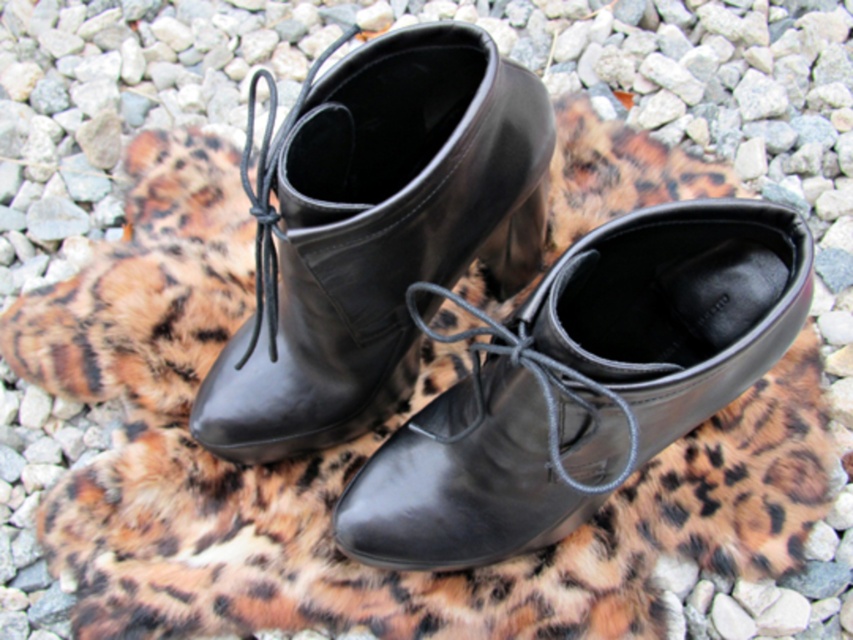
You are a delivery person who needs to place a package between the black leather shoe at center and the shiny black boot at center. The package is 7 inches long. Can you fit it between them without moving the shoes?

The black leather shoe at center and shiny black boot at center are 8.18 inches apart from each other. Since the package is 7 inches long, it can fit between them as the distance between the two shoes is greater than the package length.

You are organizing a shoe display and need to place the black leather shoe at center and the shiny black boot at center on a shelf. The shelf has limited vertical space. Based on their positions in the image, which one should you place first to ensure both fit vertically?

The black leather shoe at center is located below the shiny black boot at center, so you should place the shiny black boot at center first on the shelf to make vertical space for the black leather shoe at center below it.

You are trying to decide which footwear to wear for a hike. You have two options in front of you on the leopard print fabric surface. The black leather shoe at center is more comfortable but less waterproof. The shiny black boot at center is taller and more waterproof. Considering the description, which one would you choose and why?

The shiny black boot at center is taller than the black leather shoe at center, making it more suitable for a hike due to its increased waterproof properties and ankle support.